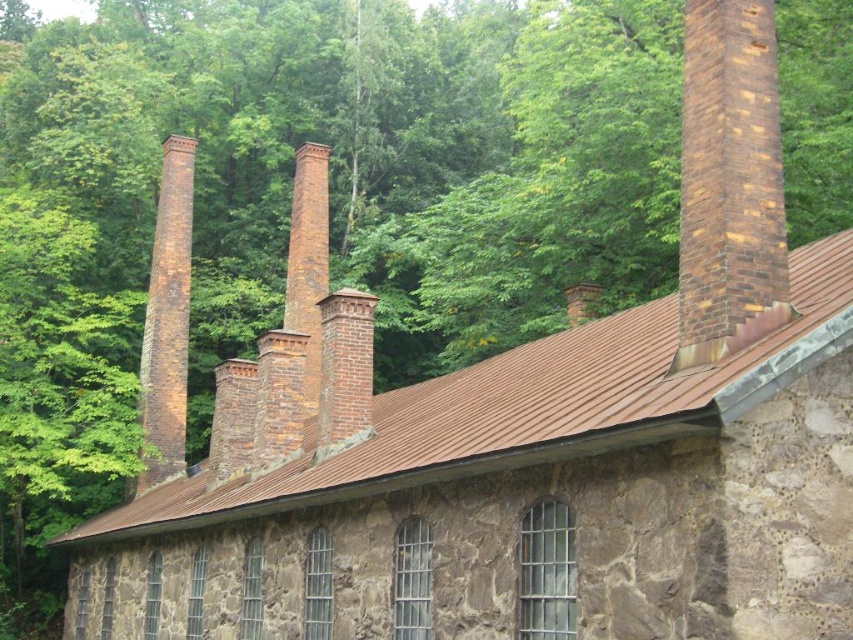
Who is shorter, brown brick chimney at upper right or brown brick chimney at left?

brown brick chimney at upper right

Is brown brick chimney at upper right positioned in front of brown brick chimney at left?

That is True.

Looking at this image, who is more distant from viewer, [743,20] or [160,342]?

The point [160,342] is behind.

Locate an element on the screen. This screenshot has height=640, width=853. brown brick chimney at upper right is located at coordinates (729, 182).